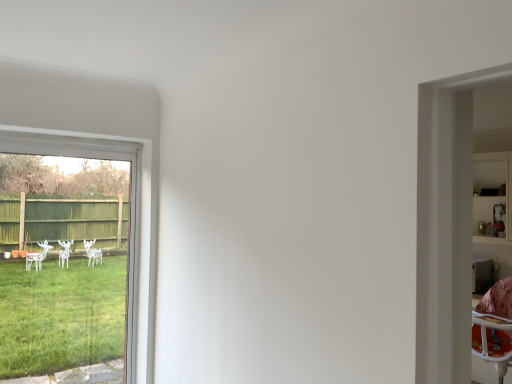
Question: Are transparent glass window at left and wooden shelf at right far apart?

Choices:
 (A) yes
 (B) no

Answer: (A)

Question: From a real-world perspective, is transparent glass window at left beneath wooden shelf at right?

Choices:
 (A) no
 (B) yes

Answer: (B)

Question: Is transparent glass window at left closer to camera compared to wooden shelf at right?

Choices:
 (A) no
 (B) yes

Answer: (B)

Question: Does transparent glass window at left have a lesser height compared to wooden shelf at right?

Choices:
 (A) no
 (B) yes

Answer: (A)

Question: Can you confirm if transparent glass window at left is positioned to the right of wooden shelf at right?

Choices:
 (A) yes
 (B) no

Answer: (B)

Question: From the image's perspective, would you say transparent glass window at left is positioned over wooden shelf at right?

Choices:
 (A) no
 (B) yes

Answer: (A)

Question: Considering the relative positions of wooden shelf at right and transparent glass window at left in the image provided, is wooden shelf at right to the left of transparent glass window at left from the viewer's perspective?

Choices:
 (A) yes
 (B) no

Answer: (B)

Question: Is wooden shelf at right at the right side of transparent glass window at left?

Choices:
 (A) yes
 (B) no

Answer: (A)

Question: Is wooden shelf at right far from transparent glass window at left?

Choices:
 (A) no
 (B) yes

Answer: (B)

Question: Considering the relative sizes of wooden shelf at right and transparent glass window at left in the image provided, is wooden shelf at right shorter than transparent glass window at left?

Choices:
 (A) no
 (B) yes

Answer: (B)

Question: From the image's perspective, is wooden shelf at right above transparent glass window at left?

Choices:
 (A) no
 (B) yes

Answer: (B)

Question: Is wooden shelf at right positioned in front of transparent glass window at left?

Choices:
 (A) no
 (B) yes

Answer: (A)

Question: In terms of width, does transparent glass window at left look wider or thinner when compared to wooden shelf at right?

Choices:
 (A) thin
 (B) wide

Answer: (A)